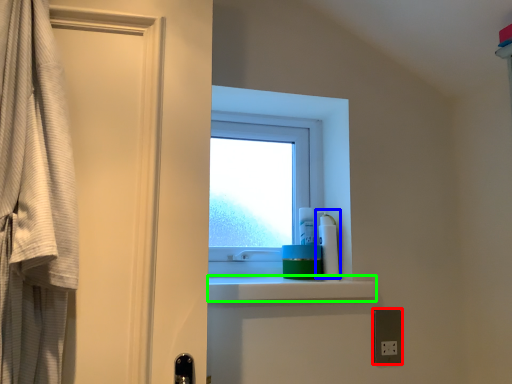
Question: Which is farther away from electric outlet (highlighted by a red box)? cleaning product (highlighted by a blue box) or balustrade (highlighted by a green box)?

Choices:
 (A) cleaning product
 (B) balustrade

Answer: (B)